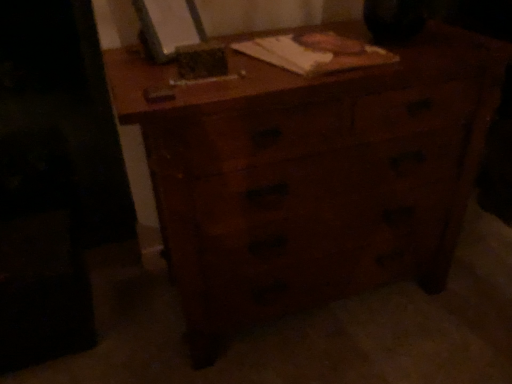
Question: Is the position of wooden notebook at center more distant than that of wooden chest of drawers at center?

Choices:
 (A) yes
 (B) no

Answer: (A)

Question: Considering the relative positions of wooden notebook at center and wooden chest of drawers at center in the image provided, is wooden notebook at center to the right of wooden chest of drawers at center from the viewer's perspective?

Choices:
 (A) no
 (B) yes

Answer: (A)

Question: Is wooden chest of drawers at center at the back of wooden notebook at center?

Choices:
 (A) no
 (B) yes

Answer: (B)

Question: Is wooden notebook at center smaller than wooden chest of drawers at center?

Choices:
 (A) yes
 (B) no

Answer: (A)

Question: Is wooden notebook at center outside of wooden chest of drawers at center?

Choices:
 (A) no
 (B) yes

Answer: (A)

Question: Does wooden notebook at center have a larger size compared to wooden chest of drawers at center?

Choices:
 (A) yes
 (B) no

Answer: (B)

Question: From the image's perspective, is wooden chest of drawers at center above wooden notebook at center?

Choices:
 (A) no
 (B) yes

Answer: (A)

Question: Is wooden chest of drawers at center smaller than wooden notebook at center?

Choices:
 (A) no
 (B) yes

Answer: (A)

Question: Is the surface of wooden chest of drawers at center in direct contact with wooden notebook at center?

Choices:
 (A) no
 (B) yes

Answer: (A)

Question: Is wooden chest of drawers at center looking in the opposite direction of wooden notebook at center?

Choices:
 (A) yes
 (B) no

Answer: (B)

Question: Considering the relative sizes of wooden chest of drawers at center and wooden notebook at center in the image provided, is wooden chest of drawers at center taller than wooden notebook at center?

Choices:
 (A) yes
 (B) no

Answer: (A)

Question: From a real-world perspective, is wooden chest of drawers at center on wooden notebook at center?

Choices:
 (A) no
 (B) yes

Answer: (A)

Question: Visually, is wooden chest of drawers at center positioned to the left or to the right of wooden notebook at center?

Choices:
 (A) left
 (B) right

Answer: (B)